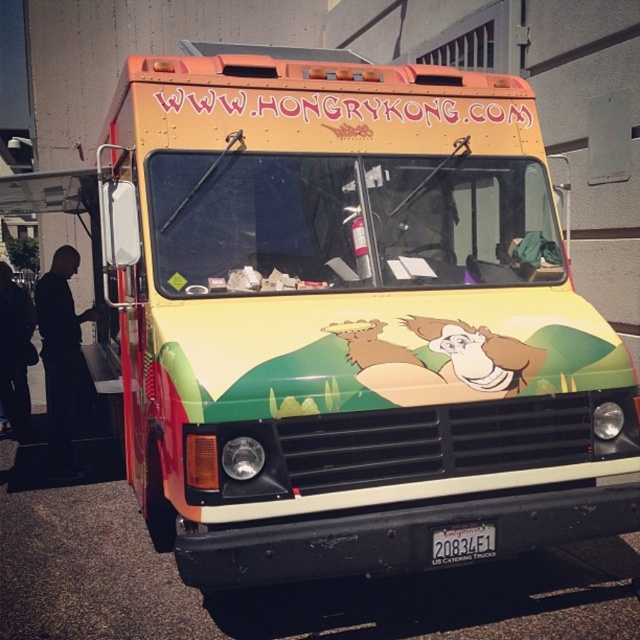
What is located at the point with coordinates (x=61, y=356) on the image?

The point at coordinates (x=61, y=356) has black matte clothing at left.

Based on the scene description, where is the black fabric pants at left located in the image?

The black fabric pants at left is located at the 2D coordinate point of (13,352) in the image.

You are standing in front of the food truck and want to take a photo. You notice two points on the truck at coordinates point (26, 404) and point (486, 532). Which point will appear closer to the camera in your photo?

Point (26, 404) is further to the camera than point (486, 532), so in the photo, point (26, 404) will appear closer to the camera than point (486, 532).